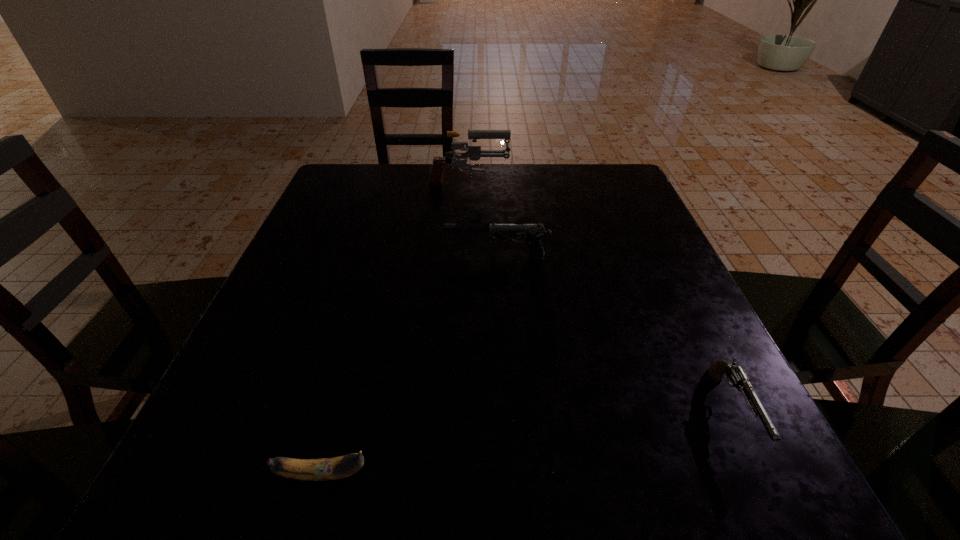
Identify the location of free point between the banana and the second shortest gun. (410, 365).

At what (x,y) coordinates should I click in order to perform the action: click on free space between the rightmost object and the banana. Please return your answer as a coordinate pair (x, y). Looking at the image, I should click on (528, 443).

The width and height of the screenshot is (960, 540). I want to click on vacant point located between the leftmost object and the second tallest object, so coord(410,365).

Identify the location of free space that is in between the leftmost object and the tallest object. This screenshot has height=540, width=960. (396, 331).

Identify which object is the second closest to the banana. Please provide its 2D coordinates. Your answer should be formatted as a tuple, i.e. [(x, y)], where the tuple contains the x and y coordinates of a point satisfying the conditions above.

[(735, 373)]

Locate which object is the second closest to the tallest gun. Please provide its 2D coordinates. Your answer should be formatted as a tuple, i.e. [(x, y)], where the tuple contains the x and y coordinates of a point satisfying the conditions above.

[(735, 373)]

This screenshot has width=960, height=540. In order to click on gun that is the closest to the nearest gun in this screenshot , I will do `click(534, 232)`.

Identify which gun is located as the nearest to the tallest object. Please provide its 2D coordinates. Your answer should be formatted as a tuple, i.e. [(x, y)], where the tuple contains the x and y coordinates of a point satisfying the conditions above.

[(534, 232)]

Identify the location of free space in the image that satisfies the following two spatial constraints: 1. aiming along the barrel of the rightmost gun; 2. on the peel of the nearest object. (763, 474).

At what (x,y) coordinates should I click in order to perform the action: click on vacant area in the image that satisfies the following two spatial constraints: 1. aiming along the barrel of the rightmost gun; 2. on the peel of the banana. Please return your answer as a coordinate pair (x, y). Image resolution: width=960 pixels, height=540 pixels. Looking at the image, I should click on (763, 474).